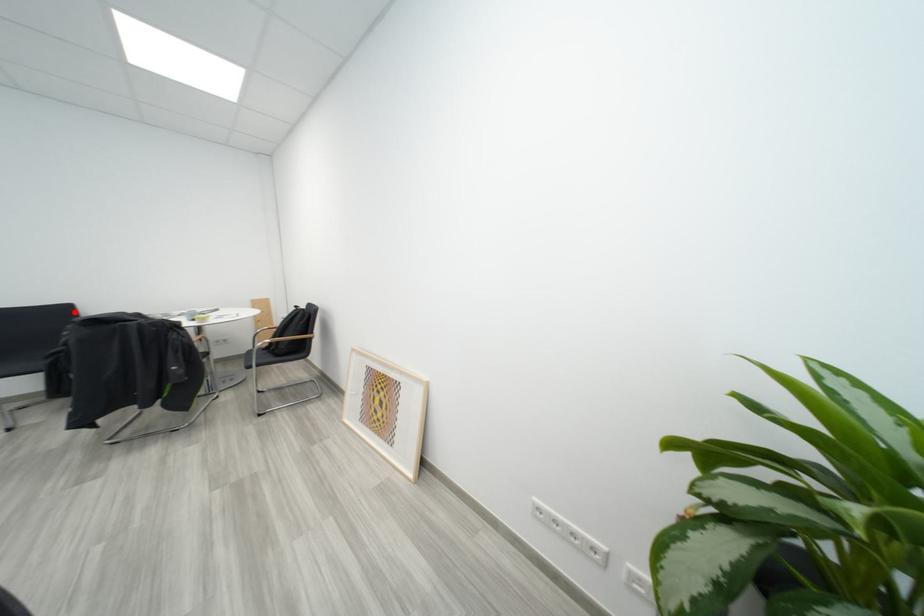
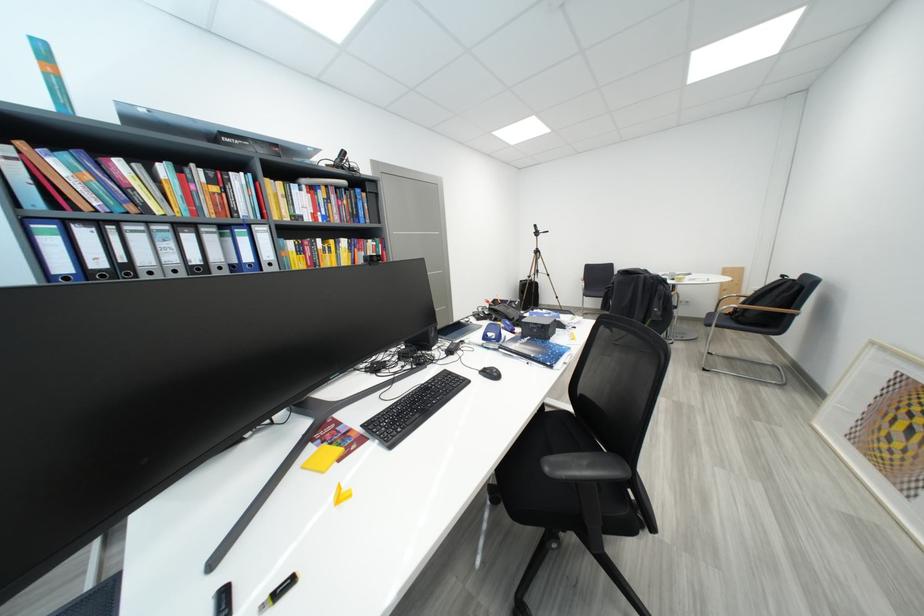
In the second image, find the point that corresponds to the highlighted location in the first image.

(618, 269)